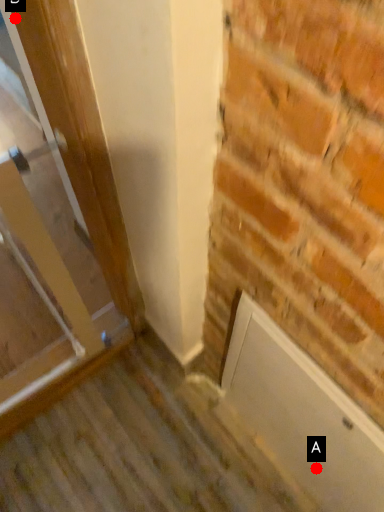
Question: Two points are circled on the image, labeled by A and B beside each circle. Which of the following is the farthest from the observer?

Choices:
 (A) A is further
 (B) B is further

Answer: (A)